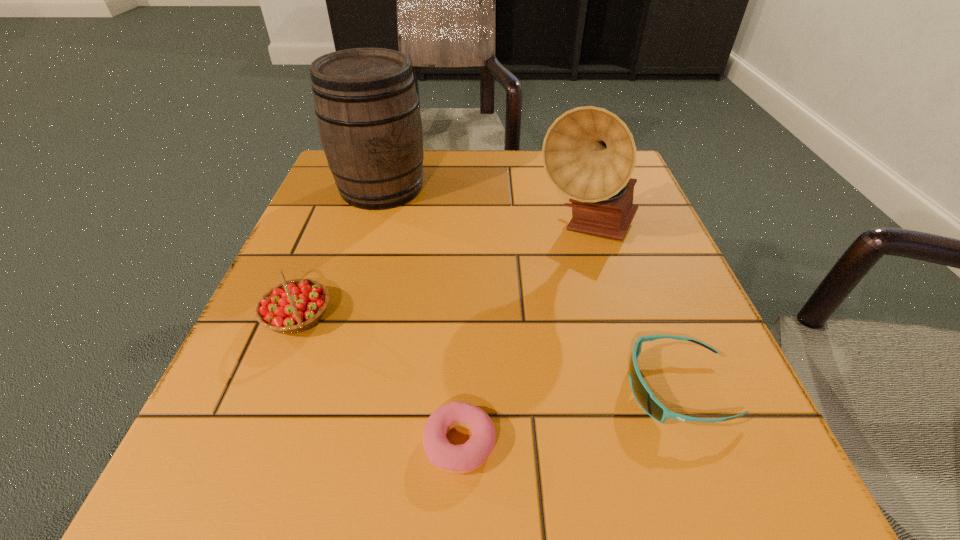
You are a GUI agent. You are given a task and a screenshot of the screen. Output one action in this format:
    pyautogui.click(x=<x>, y=<y>)
    Task: Click on the sunglasses situated at the right edge
    
    Given the screenshot: What is the action you would take?
    pyautogui.click(x=644, y=396)

Where is `object that is positioned at the far left corner`? This screenshot has width=960, height=540. object that is positioned at the far left corner is located at coordinates (367, 108).

You are a GUI agent. You are given a task and a screenshot of the screen. Output one action in this format:
    pyautogui.click(x=<x>, y=<y>)
    Task: Click on the object located at the far right corner
    This screenshot has height=540, width=960.
    Given the screenshot: What is the action you would take?
    pyautogui.click(x=589, y=154)

Identify the location of vacant space at the far edge of the desktop. (456, 185).

Where is `vacant space at the left edge of the desktop`? vacant space at the left edge of the desktop is located at coordinates pyautogui.click(x=310, y=401).

The width and height of the screenshot is (960, 540). In the image, there is a desktop. Identify the location of vacant space at the right edge. (662, 436).

Identify the location of free space at the far right corner of the desktop. The image size is (960, 540). (648, 202).

I want to click on vacant area at the near right corner of the desktop, so click(678, 447).

The width and height of the screenshot is (960, 540). What are the coordinates of `vacant space in between the wine bucket and the phonograph record` in the screenshot? It's located at (485, 209).

At what (x,y) coordinates should I click in order to perform the action: click on vacant space that's between the second shortest object and the wine bucket. Please return your answer as a coordinate pair (x, y). The width and height of the screenshot is (960, 540). Looking at the image, I should click on (530, 288).